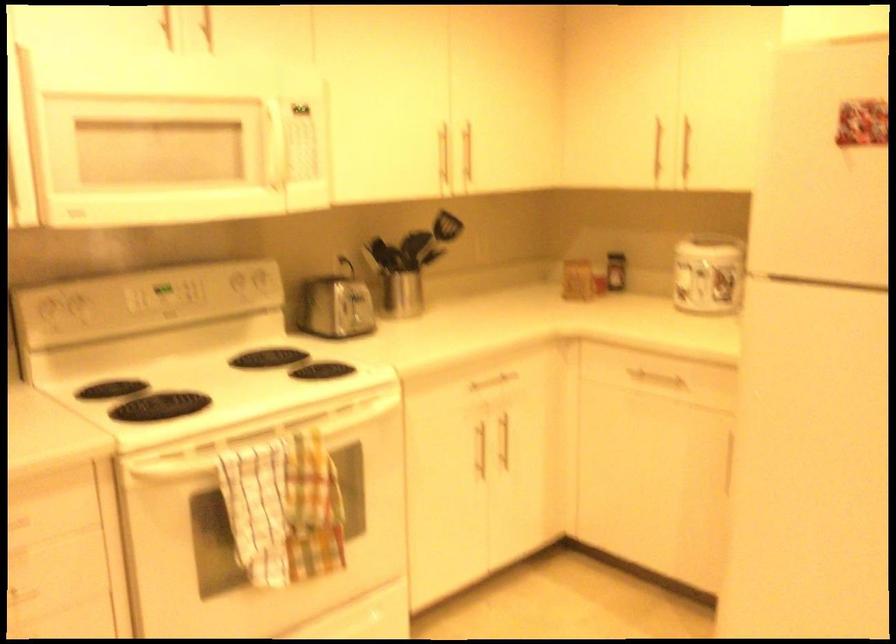
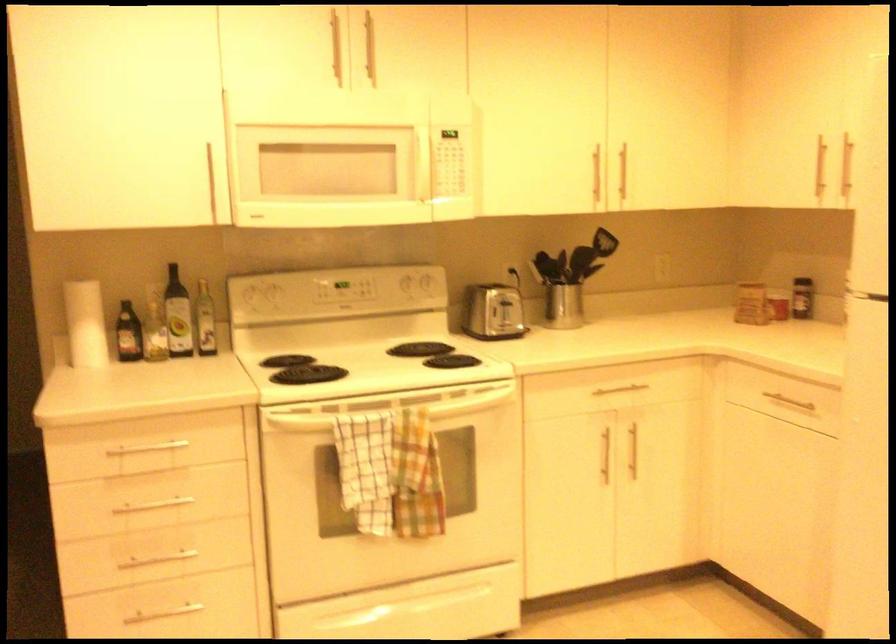
Find the pixel in the second image that matches point (281, 456) in the first image.

(390, 424)